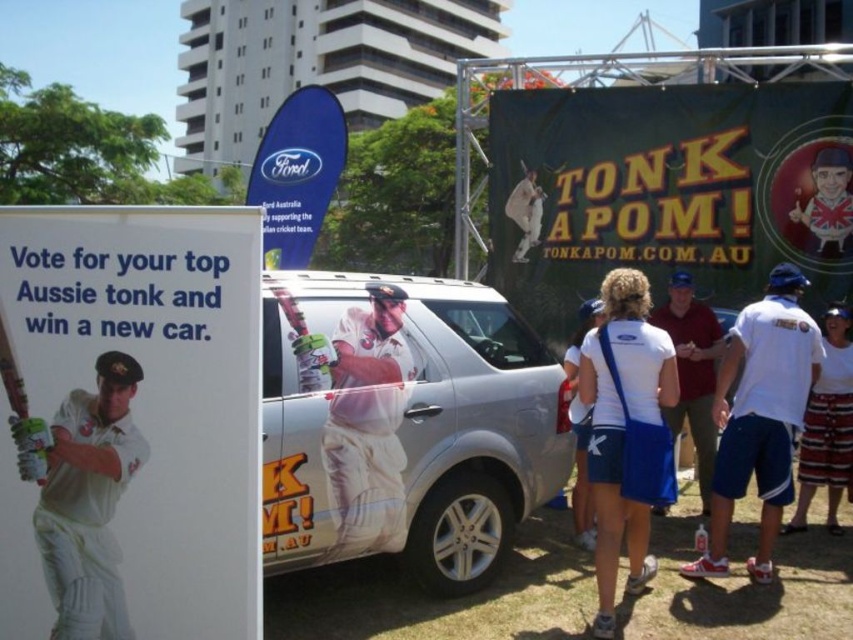
You are a photographer at the event and need to capture both the white matte cricket uniform at center and the striped shorts at lower right in a single frame. Which object should you focus on first to ensure both are in the frame?

The white matte cricket uniform at center is shorter than striped shorts at lower right, so you should focus on the striped shorts at lower right first to ensure both are captured in the frame.

What is the position of the white cloth uniform at center in the image?

The white cloth uniform at center is located at point (367, 426).